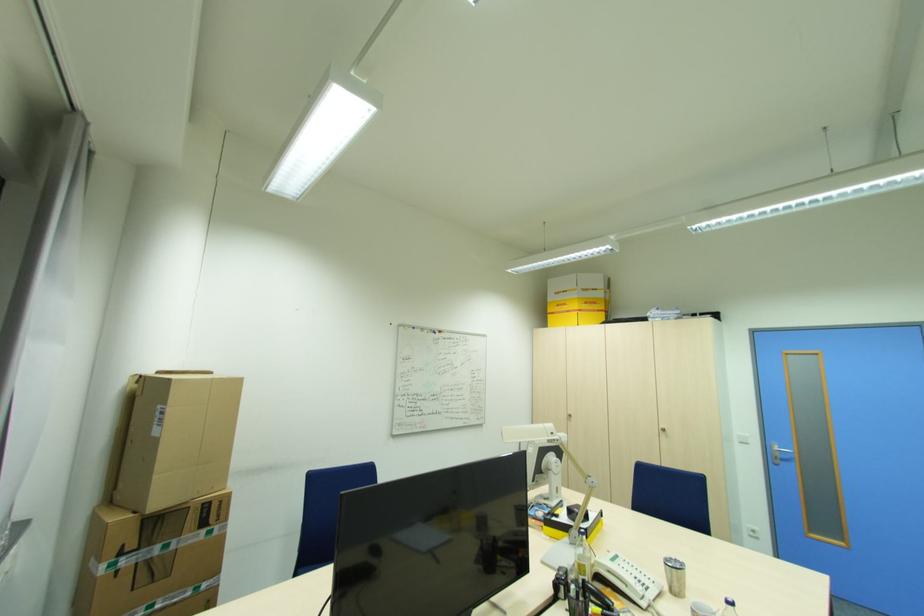
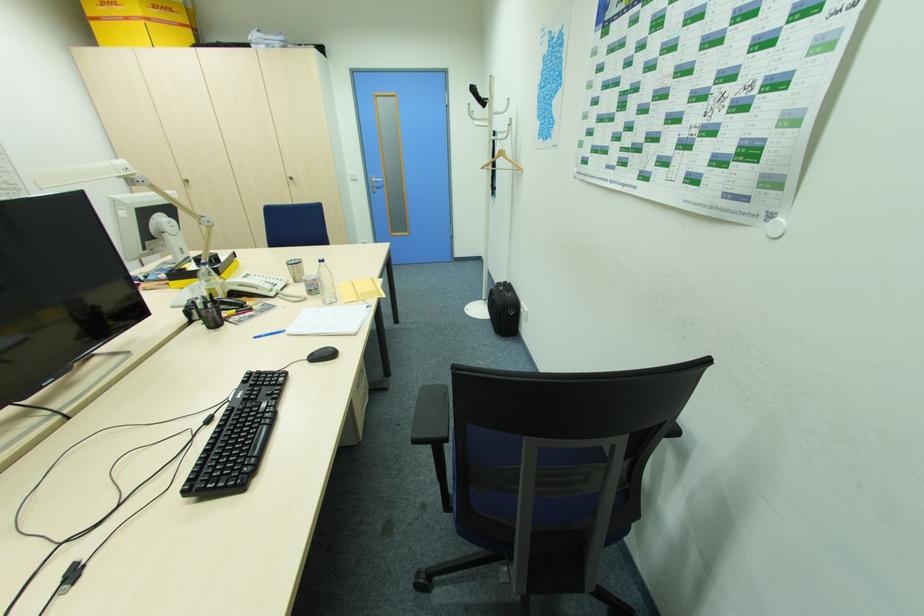
Find the pixel in the second image that matches point (546, 525) in the first image.

(173, 281)